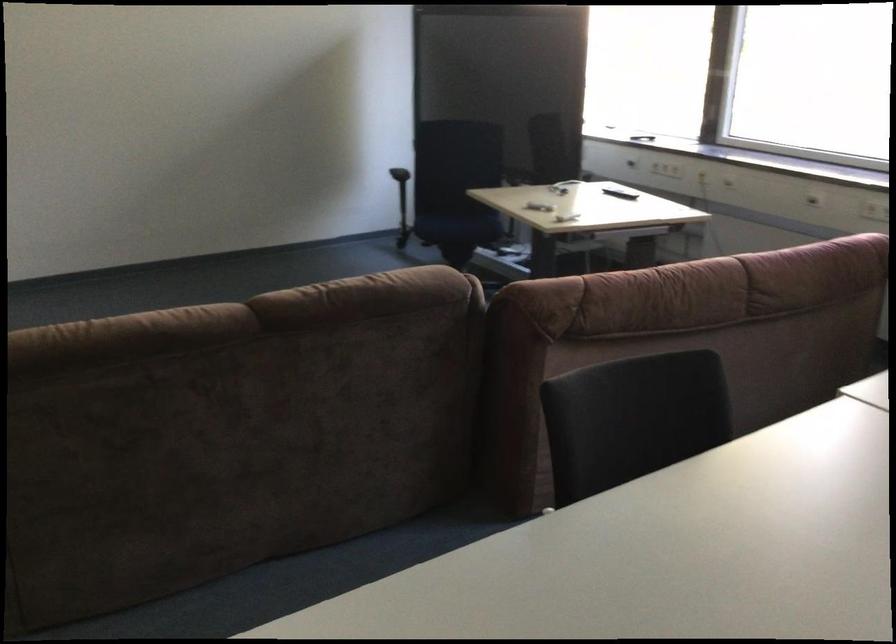
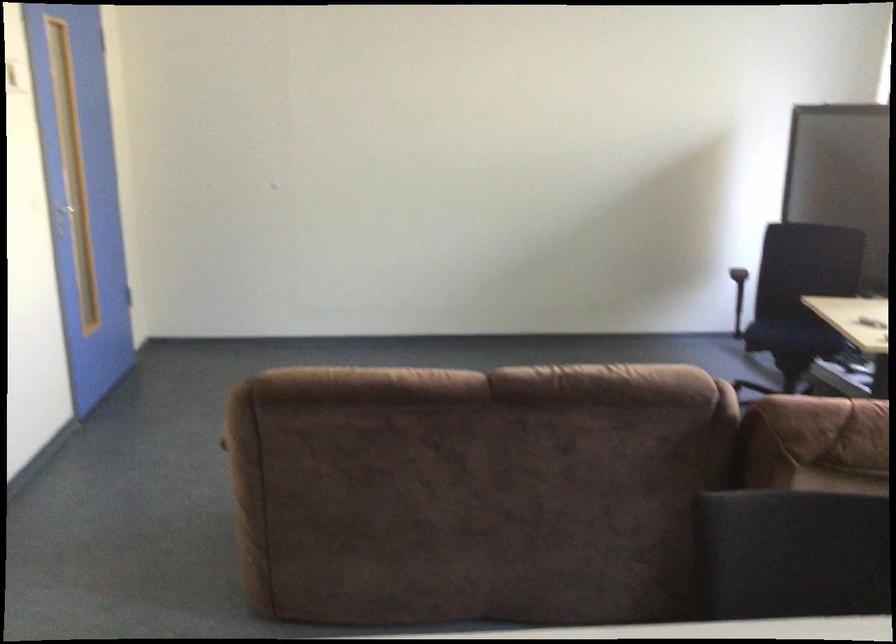
Question: Based on the continuous images, in which direction is the camera rotating? Reply with the corresponding letter.

Choices:
 (A) Left
 (B) Right
 (C) Up
 (D) Down

Answer: (A)